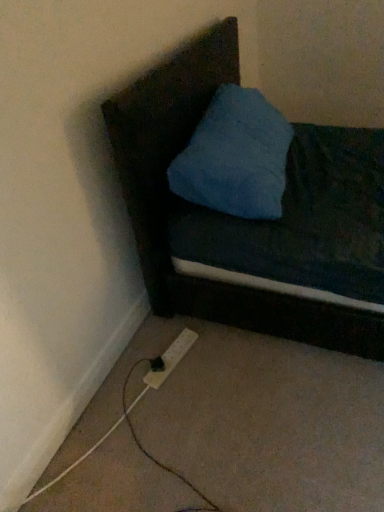
Locate an element on the screen. The width and height of the screenshot is (384, 512). vacant space situated on the left part of white plastic power plugs and sockets at lower left is located at coordinates (x=125, y=367).